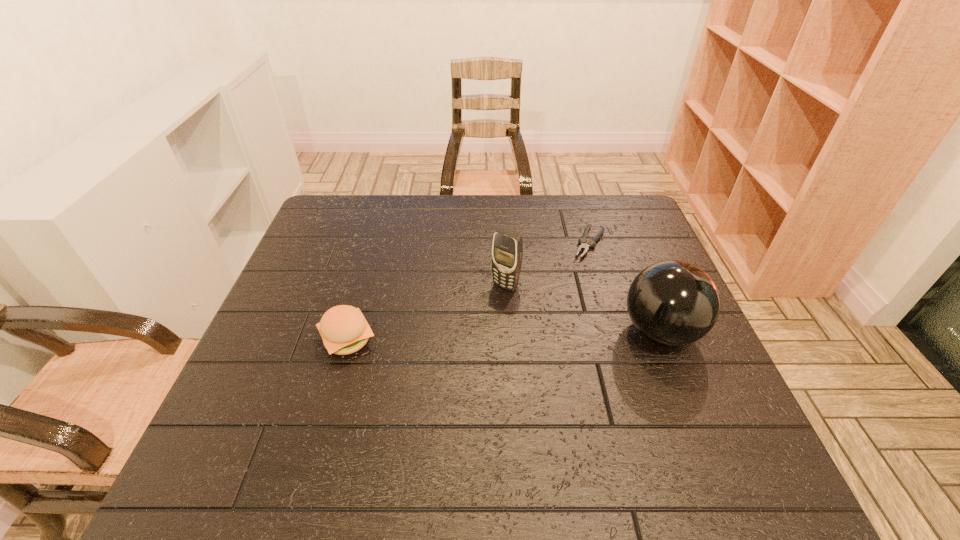
In order to click on free space located at the gripping part of the pliers in this screenshot , I will do `click(568, 288)`.

Where is `free region located on the front face of the third object from right to left`? free region located on the front face of the third object from right to left is located at coordinates (478, 317).

Where is `free space located on the front face of the third object from right to left`? The image size is (960, 540). free space located on the front face of the third object from right to left is located at coordinates (467, 330).

Identify the location of blank space located 0.320m on the front face of the third object from right to left. (424, 381).

Find the location of a particular element. Image resolution: width=960 pixels, height=540 pixels. object situated at the far edge is located at coordinates (583, 246).

Image resolution: width=960 pixels, height=540 pixels. I want to click on object present at the left edge, so click(x=344, y=330).

Locate an element on the screen. bowling ball located in the right edge section of the desktop is located at coordinates (674, 303).

You are a GUI agent. You are given a task and a screenshot of the screen. Output one action in this format:
    pyautogui.click(x=<x>, y=<y>)
    Task: Click on the pliers present at the right edge
    This screenshot has height=540, width=960.
    Given the screenshot: What is the action you would take?
    pyautogui.click(x=583, y=246)

You are a GUI agent. You are given a task and a screenshot of the screen. Output one action in this format:
    pyautogui.click(x=<x>, y=<y>)
    Task: Click on the object that is at the far right corner
    The width and height of the screenshot is (960, 540).
    Given the screenshot: What is the action you would take?
    pyautogui.click(x=583, y=246)

You are a GUI agent. You are given a task and a screenshot of the screen. Output one action in this format:
    pyautogui.click(x=<x>, y=<y>)
    Task: Click on the vacant position at the far edge of the desktop
    This screenshot has height=540, width=960.
    Given the screenshot: What is the action you would take?
    pyautogui.click(x=429, y=197)